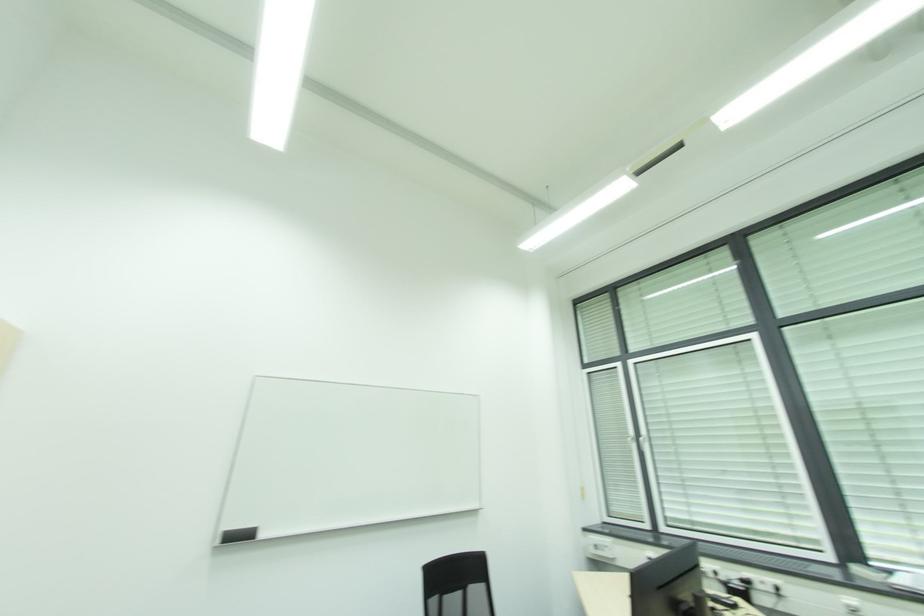
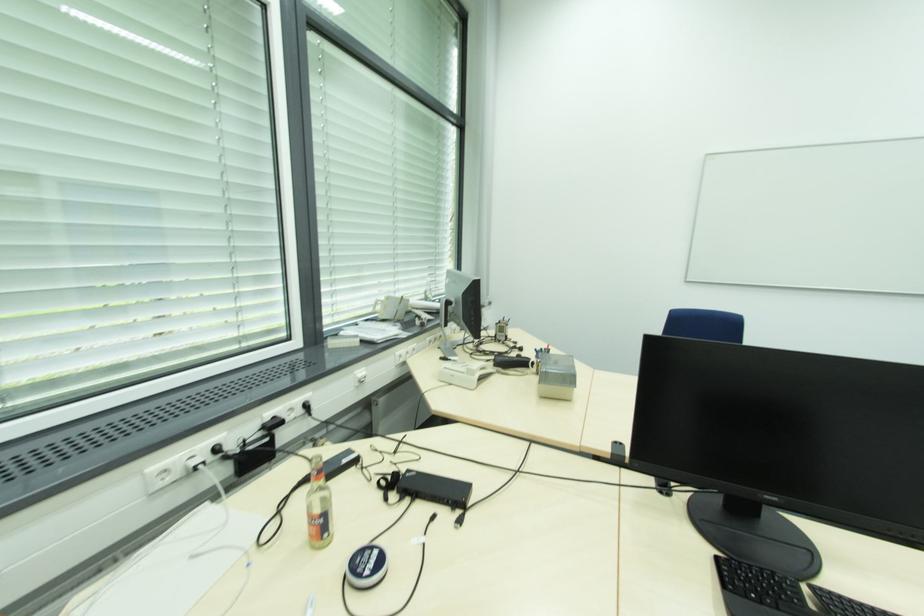
In the second image, find the point that corresponds to [767,583] in the first image.

(294, 410)